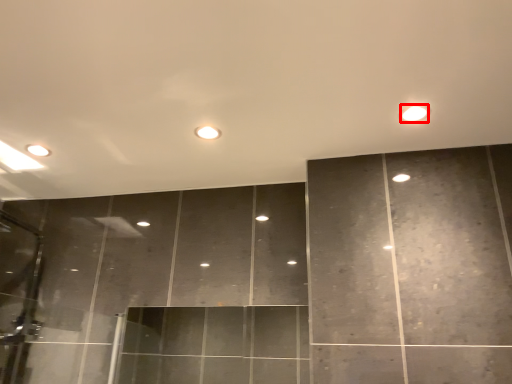
Question: From the image's perspective, what is the correct spatial relationship of light (annotated by the red box) in relation to light?

Choices:
 (A) above
 (B) below

Answer: (A)